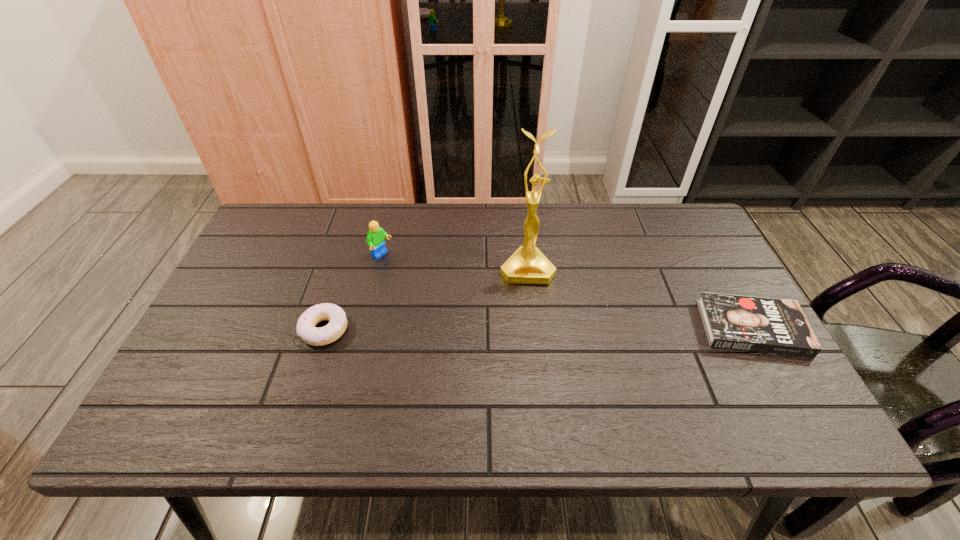
Image resolution: width=960 pixels, height=540 pixels. In the image, there is a desktop. Identify the location of vacant space at the near edge. (555, 395).

You are a GUI agent. You are given a task and a screenshot of the screen. Output one action in this format:
    pyautogui.click(x=<x>, y=<y>)
    Task: Click on the vacant space at the left edge of the desktop
    The width and height of the screenshot is (960, 540).
    Given the screenshot: What is the action you would take?
    pyautogui.click(x=283, y=253)

The image size is (960, 540). I want to click on free spot at the right edge of the desktop, so click(x=685, y=303).

Locate an element on the screen. The width and height of the screenshot is (960, 540). vacant space at the far left corner of the desktop is located at coordinates (270, 241).

Where is `free space at the far right corner of the desktop`? This screenshot has height=540, width=960. free space at the far right corner of the desktop is located at coordinates (668, 240).

The width and height of the screenshot is (960, 540). In the image, there is a desktop. Identify the location of vacant space at the near right corner. (759, 372).

You are a GUI agent. You are given a task and a screenshot of the screen. Output one action in this format:
    pyautogui.click(x=<x>, y=<y>)
    Task: Click on the unoccupied area between the award and the third tallest object
    This screenshot has width=960, height=540.
    Given the screenshot: What is the action you would take?
    pyautogui.click(x=426, y=299)

Locate an element on the screen. The image size is (960, 540). free space between the rightmost object and the second object from right to left is located at coordinates [639, 298].

At what (x,y) coordinates should I click in order to perform the action: click on free space between the second object from left to right and the award. Please return your answer as a coordinate pair (x, y). The width and height of the screenshot is (960, 540). Looking at the image, I should click on (454, 262).

Find the location of a particular element. This screenshot has width=960, height=540. free space that is in between the leftmost object and the second tallest object is located at coordinates (353, 293).